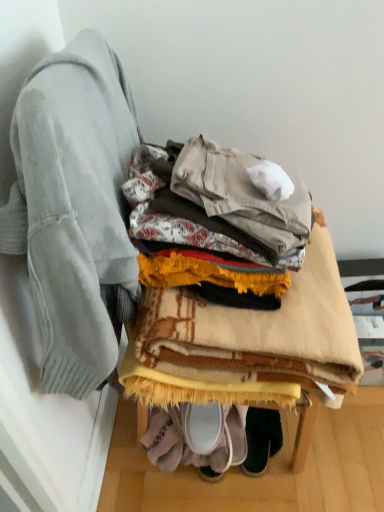
Question: Is beige woven blanket at center inside or outside of light gray sweater at left?

Choices:
 (A) inside
 (B) outside

Answer: (B)

Question: Based on their sizes in the image, would you say beige woven blanket at center is bigger or smaller than light gray sweater at left?

Choices:
 (A) big
 (B) small

Answer: (A)

Question: Which object is positioned farthest from the beige woven blanket at center?

Choices:
 (A) dark green suede shoes at lower center
 (B) light gray sweater at left

Answer: (A)

Question: Based on their relative distances, which object is farther from the beige woven blanket at center?

Choices:
 (A) light gray sweater at left
 (B) dark green suede shoes at lower center

Answer: (B)